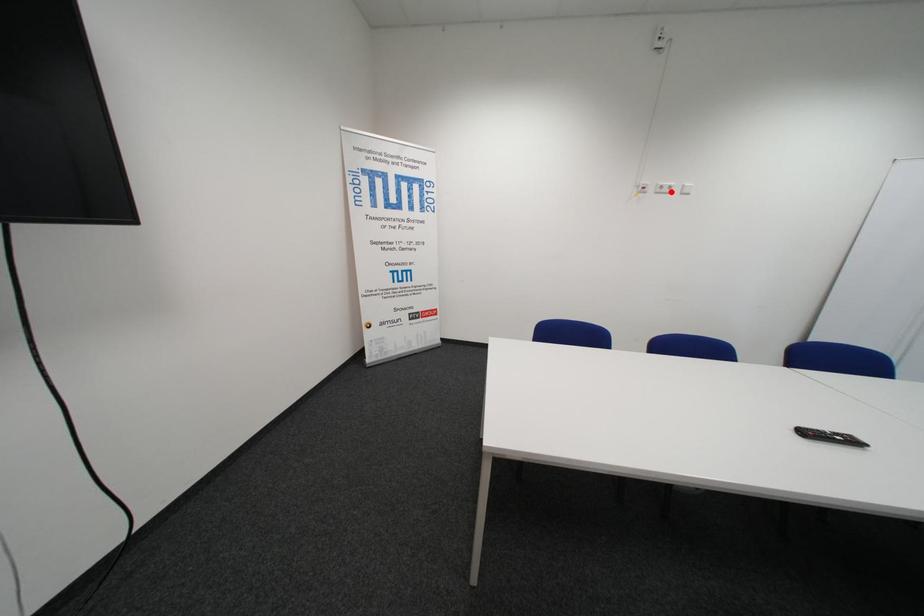
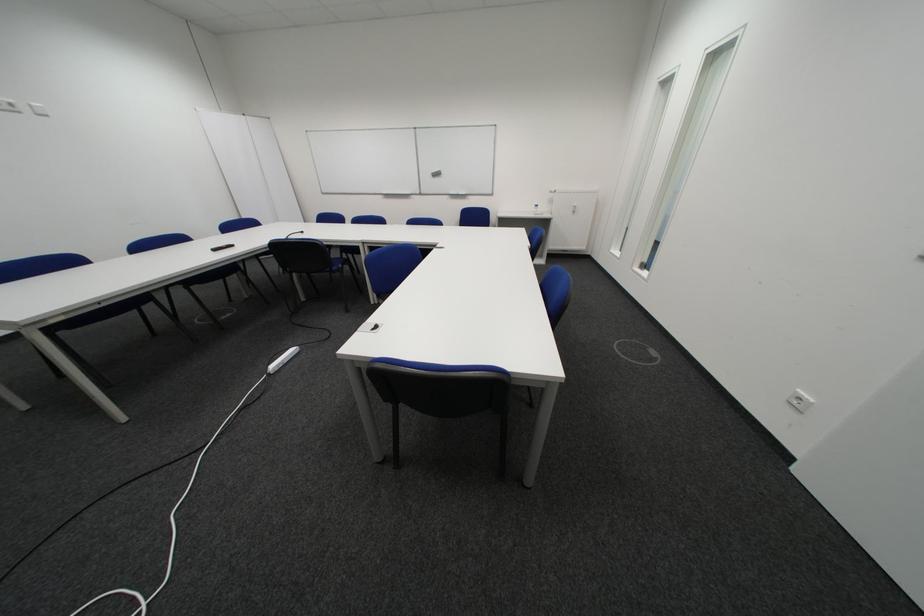
Question: A red point is marked in image1. In image2, is the corresponding 3D point closer to the camera or farther? Reply with the corresponding letter.

Choices:
 (A) The corresponding 3D point is closer.
 (B) The corresponding 3D point is farther.

Answer: (B)